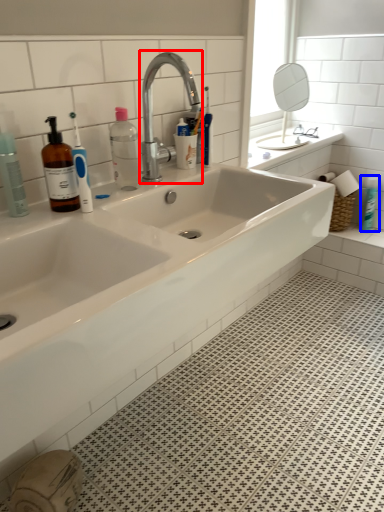
Question: Which point is further to the camera, tap (highlighted by a red box) or toiletry (highlighted by a blue box)?

Choices:
 (A) tap
 (B) toiletry

Answer: (B)